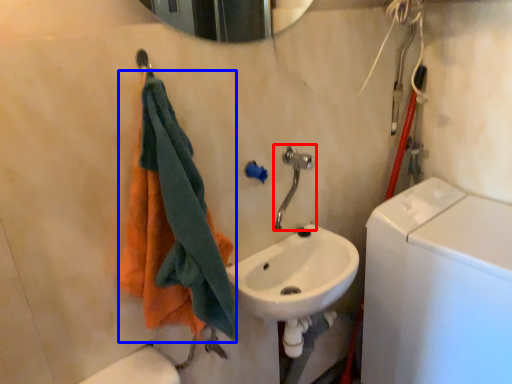
Question: Which of the following is the closest to the observer, plumbing fixture (highlighted by a red box) or towel (highlighted by a blue box)?

Choices:
 (A) plumbing fixture
 (B) towel

Answer: (B)